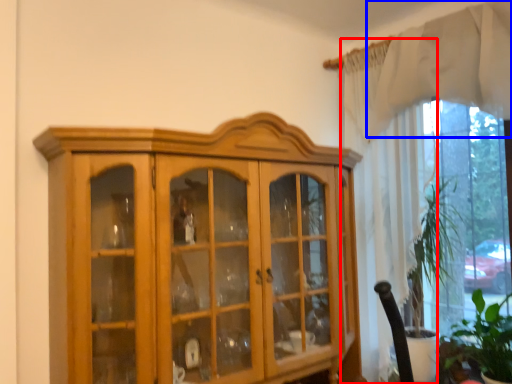
Question: Which object appears farthest to the camera in this image, curtain (highlighted by a red box) or curtain (highlighted by a blue box)?

Choices:
 (A) curtain
 (B) curtain

Answer: (A)